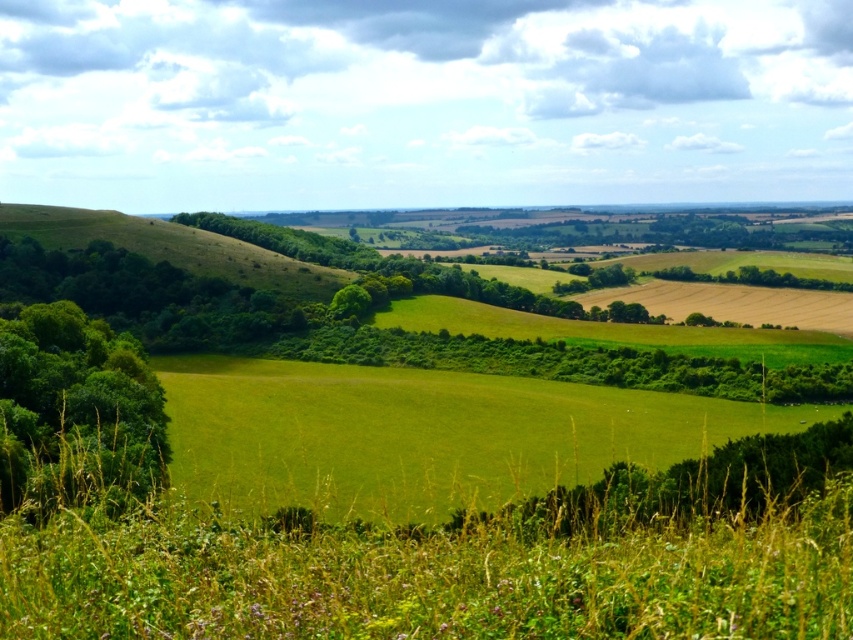
Is green grassy field at center taller than green leafy tree at left?

No.

The image size is (853, 640). What do you see at coordinates (422, 435) in the screenshot? I see `green grassy field at center` at bounding box center [422, 435].

Find the location of a particular element. Image resolution: width=853 pixels, height=640 pixels. green grassy field at center is located at coordinates (422, 435).